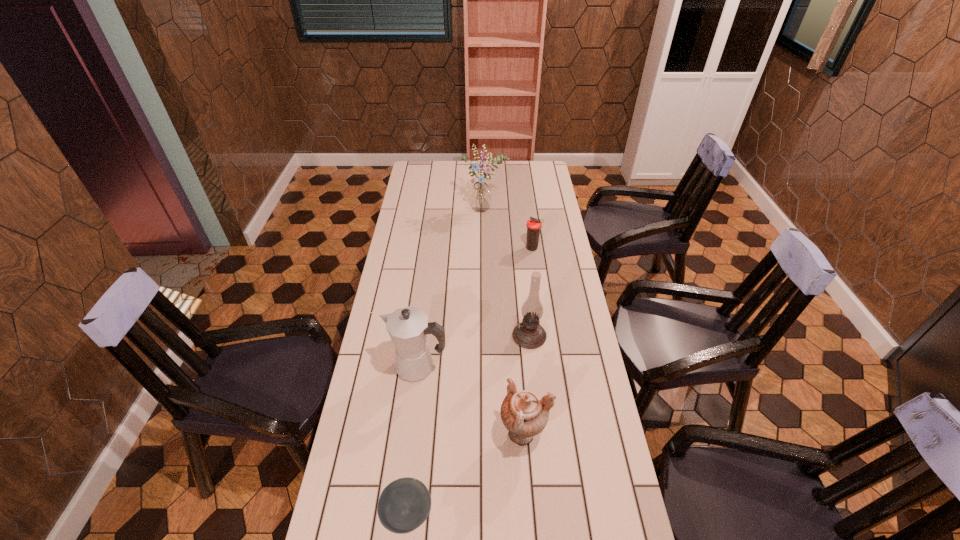
The width and height of the screenshot is (960, 540). I want to click on bouquet, so click(x=480, y=197).

Where is `oil lamp`? The image size is (960, 540). oil lamp is located at coordinates (529, 333).

Locate an element on the screen. This screenshot has width=960, height=540. the fourth farthest object is located at coordinates (408, 327).

The image size is (960, 540). I want to click on the fifth farthest object, so click(x=525, y=414).

Identify the location of the fourth tallest object. The width and height of the screenshot is (960, 540). (525, 414).

Locate an element on the screen. thermos bottle is located at coordinates (534, 225).

Find the location of a particular element. the fifth tallest object is located at coordinates (534, 225).

Locate an element on the screen. The image size is (960, 540). blank area located on the front-facing side of the farthest object is located at coordinates (486, 274).

At what (x,y) coordinates should I click in order to perform the action: click on free spot located on the back of the oil lamp. Please return your answer as a coordinate pair (x, y). This screenshot has height=540, width=960. Looking at the image, I should click on (521, 255).

The height and width of the screenshot is (540, 960). I want to click on vacant region located on the front of the coffeepot, so click(410, 436).